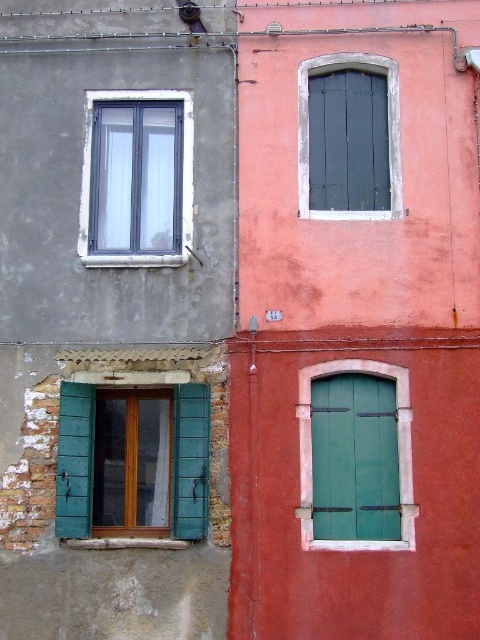
You are a delivery person trying to find the entrance to the building with the green matte door at center. Based on the scene, where should you look relative to the white plastic window at upper left?

The green matte door at center is located below the white plastic window at upper left, so you should look directly beneath the window to find the entrance.

You are standing at the point marked as point (x=75, y=460) in the image. Looking around, you see the green wooden window at center. Which building does this window belong to?

The green wooden window at center is located at point (x=75, y=460), which is part of the building on the right painted in a vivid reddish orange hue.